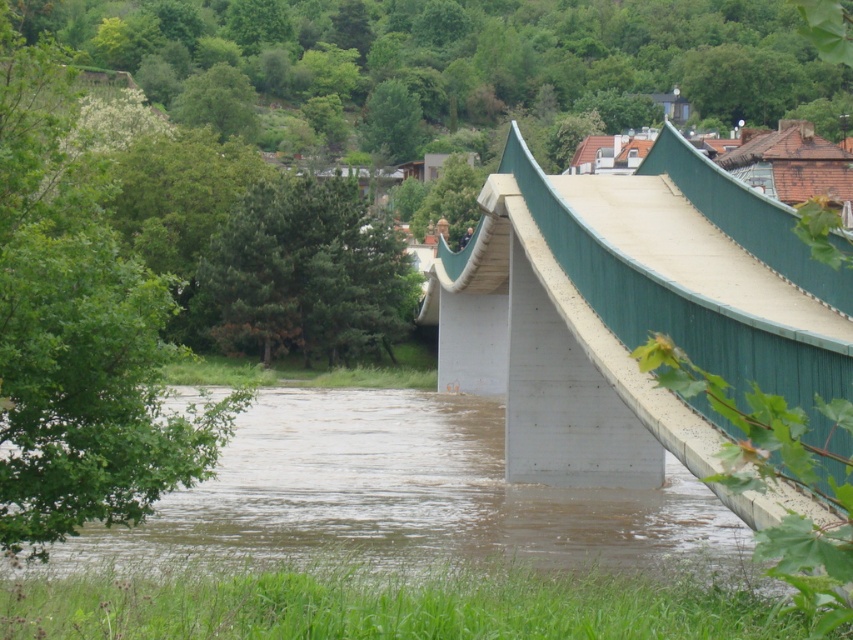
You are a rescue worker assessing the flooded area. You need to determine if a 5.5 meter long inflatable boat can safely navigate between the concrete bridge at center and the brown concrete river at lower center. Is there enough space for the boat to pass through?

The concrete bridge at center and brown concrete river at lower center are 5.46 meters apart from each other. Since the boat is 5.5 meters long, it is slightly too long to fit through the gap. The rescue worker should consider using a shorter boat or finding an alternative route.

You are a city planner reviewing flood risk areas. You see the concrete bridge at center and the brown concrete river at lower center in the image. Which of these two structures takes up more area in the image?

The brown concrete river at lower center occupies more space than the concrete bridge at center in the image.